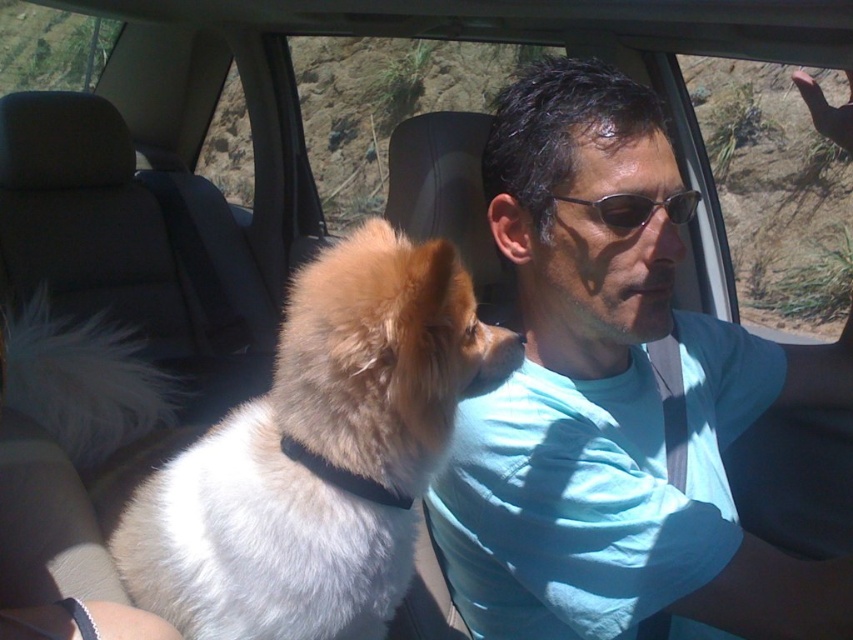
Question: From the image, what is the correct spatial relationship of transparent glass car window at upper right in relation to sunglasses at center?

Choices:
 (A) above
 (B) below

Answer: (A)

Question: Can you confirm if transparent glass car window at upper right is positioned above sunglasses at center?

Choices:
 (A) yes
 (B) no

Answer: (A)

Question: Can you confirm if light blue t-shirt at center is thinner than transparent glass car window at upper right?

Choices:
 (A) no
 (B) yes

Answer: (B)

Question: Which object appears closest to the camera in this image?

Choices:
 (A) white fluffy dog at center
 (B) sunglasses at center
 (C) transparent glass car window at upper right
 (D) light blue t-shirt at center

Answer: (A)

Question: Which point is farther to the camera?

Choices:
 (A) (726, 234)
 (B) (328, 413)

Answer: (A)

Question: Among these objects, which one is nearest to the camera?

Choices:
 (A) light blue t-shirt at center
 (B) sunglasses at center
 (C) transparent glass car window at upper right
 (D) white fluffy dog at center

Answer: (D)